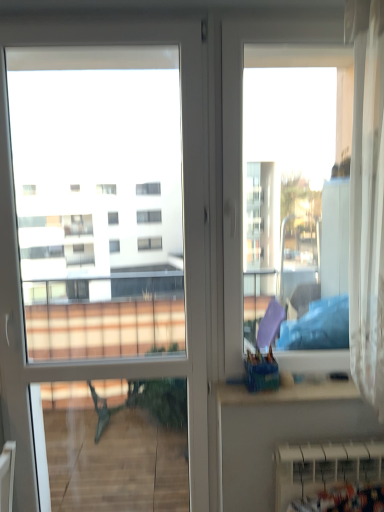
Question: Considering the relative positions of white plastic radiator at lower right and white glossy door at left in the image provided, is white plastic radiator at lower right to the left of white glossy door at left from the viewer's perspective?

Choices:
 (A) no
 (B) yes

Answer: (A)

Question: Is white plastic radiator at lower right in front of white glossy door at left?

Choices:
 (A) no
 (B) yes

Answer: (A)

Question: Is there a large distance between white plastic radiator at lower right and white glossy door at left?

Choices:
 (A) no
 (B) yes

Answer: (A)

Question: Does white plastic radiator at lower right have a larger size compared to white glossy door at left?

Choices:
 (A) no
 (B) yes

Answer: (A)

Question: Are white plastic radiator at lower right and white glossy door at left making contact?

Choices:
 (A) yes
 (B) no

Answer: (B)

Question: Does white plastic radiator at lower right appear on the right side of white glossy door at left?

Choices:
 (A) yes
 (B) no

Answer: (A)

Question: Is white glossy door at left smaller than white plastic radiator at lower right?

Choices:
 (A) no
 (B) yes

Answer: (A)

Question: Considering the relative positions of white glossy door at left and white plastic radiator at lower right in the image provided, is white glossy door at left to the left of white plastic radiator at lower right from the viewer's perspective?

Choices:
 (A) yes
 (B) no

Answer: (A)

Question: Is white glossy door at left positioned with its back to white plastic radiator at lower right?

Choices:
 (A) yes
 (B) no

Answer: (B)

Question: Considering the relative sizes of white glossy door at left and white plastic radiator at lower right in the image provided, is white glossy door at left shorter than white plastic radiator at lower right?

Choices:
 (A) yes
 (B) no

Answer: (B)

Question: From the image's perspective, does white glossy door at left appear lower than white plastic radiator at lower right?

Choices:
 (A) no
 (B) yes

Answer: (A)

Question: From a real-world perspective, is white glossy door at left beneath white plastic radiator at lower right?

Choices:
 (A) no
 (B) yes

Answer: (A)

Question: Relative to white plastic radiator at lower right, is white glossy door at left in front or behind?

Choices:
 (A) front
 (B) behind

Answer: (A)